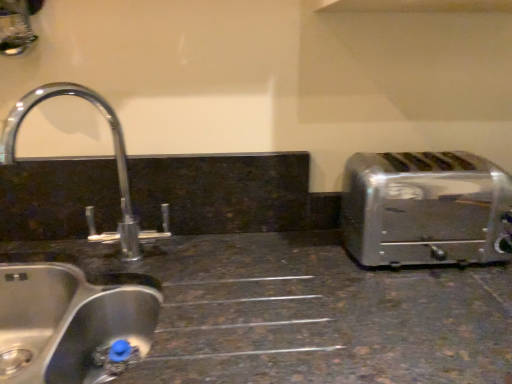
Where is `vacant space underneath brushed metal sink at left, which is the first sink in top-to-bottom order (from a real-world perspective)`? The height and width of the screenshot is (384, 512). vacant space underneath brushed metal sink at left, which is the first sink in top-to-bottom order (from a real-world perspective) is located at coordinates coord(104,283).